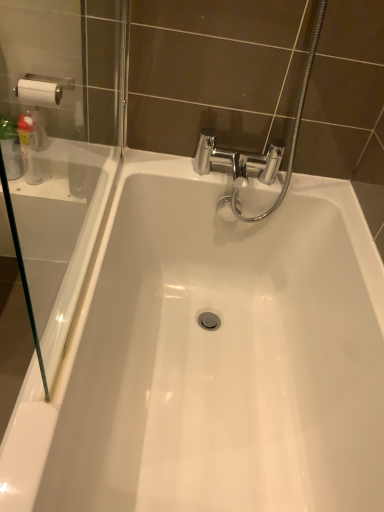
Question: Looking at their shapes, would you say transparent glass screen door at left is wider or thinner than translucent plastic bottle at left?

Choices:
 (A) thin
 (B) wide

Answer: (A)

Question: From their relative heights in the image, would you say transparent glass screen door at left is taller or shorter than translucent plastic bottle at left?

Choices:
 (A) short
 (B) tall

Answer: (B)

Question: Based on their relative distances, which object is farther from the translucent plastic bottle at left?

Choices:
 (A) transparent glass screen door at left
 (B) white glossy bathtub at center

Answer: (B)

Question: Which is nearer to the transparent glass screen door at left?

Choices:
 (A) translucent plastic bottle at left
 (B) white glossy bathtub at center

Answer: (A)